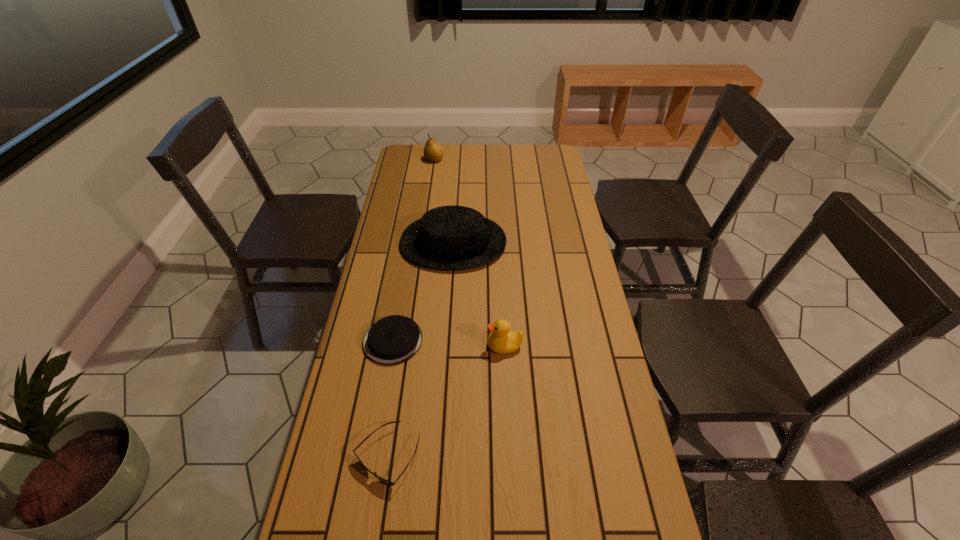
In the image, there is a desktop. Identify the location of free space at the left edge. The width and height of the screenshot is (960, 540). (393, 279).

This screenshot has height=540, width=960. I want to click on blank space at the right edge of the desktop, so click(x=563, y=262).

Where is `free space at the far right corner of the desktop`? This screenshot has width=960, height=540. free space at the far right corner of the desktop is located at coordinates [x=536, y=166].

The image size is (960, 540). What are the coordinates of `vacant region between the nearest object and the duck` in the screenshot? It's located at (446, 401).

Identify the location of vacant area between the sunglasses and the duck. This screenshot has width=960, height=540. (446, 401).

I want to click on free point between the nearest object and the farthest object, so click(411, 308).

Identify which object is the fourth nearest to the duck. Please provide its 2D coordinates. Your answer should be formatted as a tuple, i.e. [(x, y)], where the tuple contains the x and y coordinates of a point satisfying the conditions above.

[(433, 152)]

The height and width of the screenshot is (540, 960). Find the location of `the third closest object to the second shortest object`. the third closest object to the second shortest object is located at coordinates (452, 237).